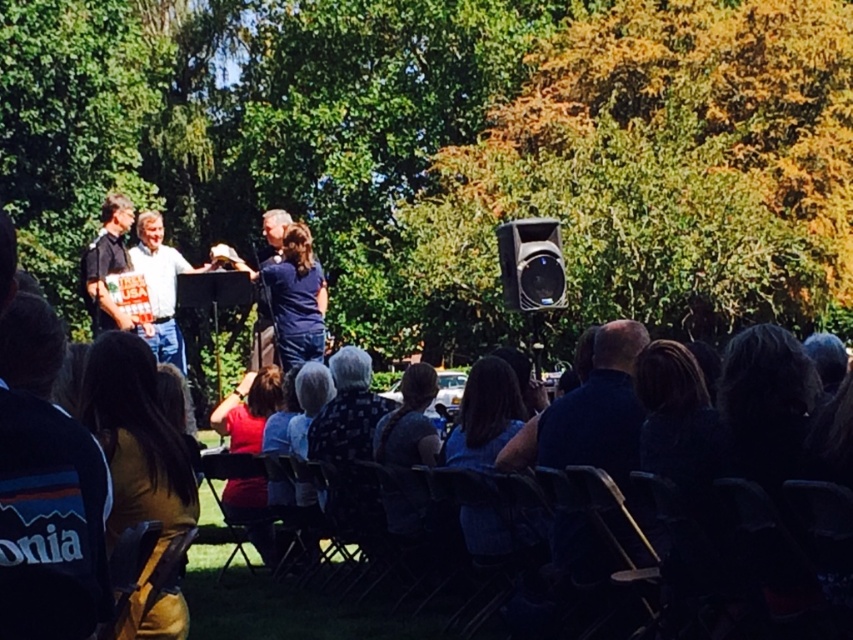
Question: Estimate the real-world distances between objects in this image. Which object is farther from the dark gray shirt at center?

Choices:
 (A) red shirt at center
 (B) matte black speaker at center
 (C) dark blue jacket at lower left

Answer: (B)

Question: Among these points, which one is nearest to the camera?

Choices:
 (A) (80, 474)
 (B) (294, 307)

Answer: (A)

Question: Considering the relative positions of red shirt at center and matte black speaker at center in the image provided, where is red shirt at center located with respect to matte black speaker at center?

Choices:
 (A) right
 (B) left

Answer: (B)

Question: Which of the following is the farthest from the observer?

Choices:
 (A) red shirt at center
 (B) matte black speaker at center

Answer: (B)

Question: Can you confirm if matte black speaker at center is bigger than dark gray shirt at center?

Choices:
 (A) no
 (B) yes

Answer: (B)

Question: Is matte black speaker at center above white shirt at center?

Choices:
 (A) no
 (B) yes

Answer: (A)